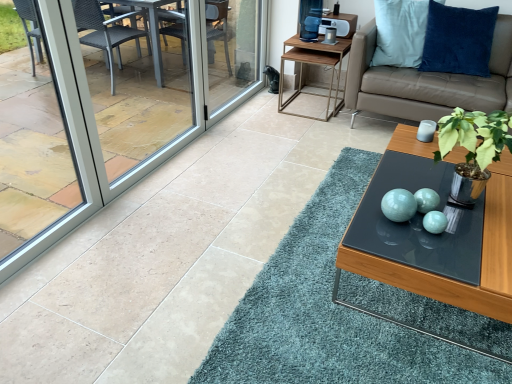
The image size is (512, 384). Find the location of `vacant space situated on the left part of matte turquoise spheres at center`. vacant space situated on the left part of matte turquoise spheres at center is located at coordinates (364, 220).